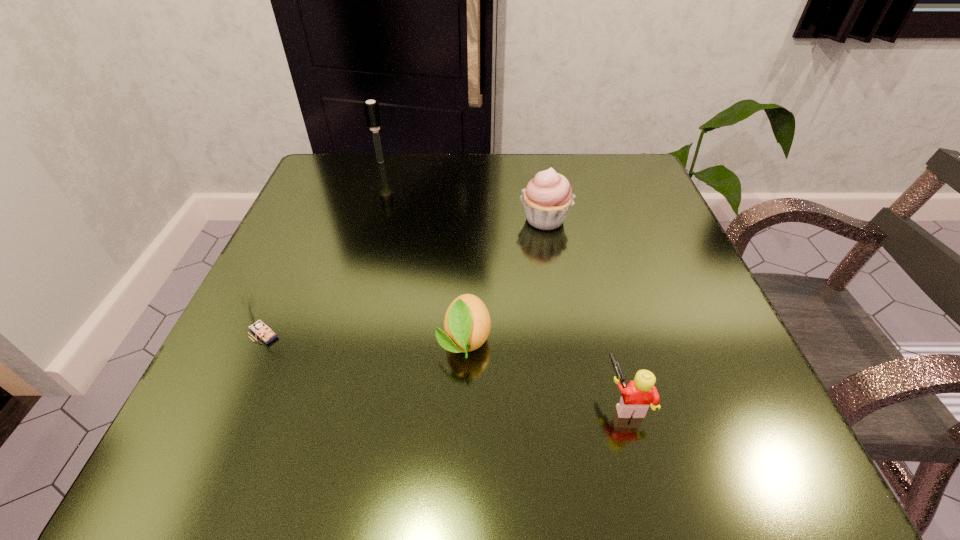
You are a GUI agent. You are given a task and a screenshot of the screen. Output one action in this format:
    pyautogui.click(x=<x>, y=<y>)
    Task: Click on the tallest object
    
    Given the screenshot: What is the action you would take?
    pyautogui.click(x=372, y=111)

The height and width of the screenshot is (540, 960). What are the coordinates of `hairbrush` in the screenshot? It's located at (372, 111).

At what (x,y) coordinates should I click in order to perform the action: click on the second tallest object. Please return your answer as a coordinate pair (x, y). This screenshot has width=960, height=540. Looking at the image, I should click on (547, 199).

Find the location of a particular element. The width and height of the screenshot is (960, 540). cupcake is located at coordinates (547, 199).

Find the location of a particular element. the nearest object is located at coordinates (637, 396).

Locate an element on the screen. This screenshot has height=540, width=960. matchbox is located at coordinates point(260,329).

This screenshot has width=960, height=540. In order to click on the third object from left to right in this screenshot , I will do `click(467, 323)`.

Find the location of a particular element. free space located 0.100m on the left of the farthest object is located at coordinates (331, 161).

What are the coordinates of `vacant region located on the right of the second tallest object` in the screenshot? It's located at (621, 220).

Where is `vacant space located 0.110m in front of the nearest object with the accessory visible`? This screenshot has width=960, height=540. vacant space located 0.110m in front of the nearest object with the accessory visible is located at coordinates (525, 401).